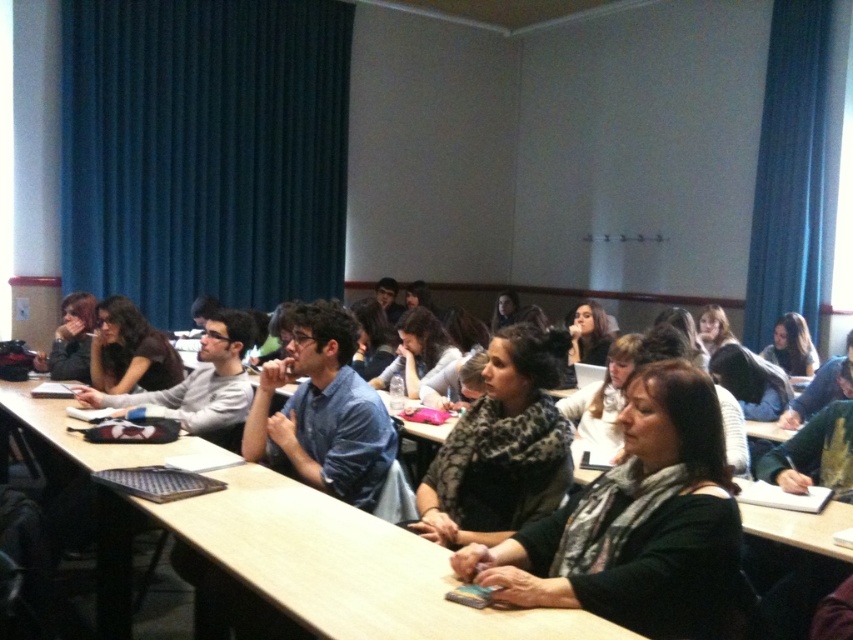
You are a student in the classroom. You need to place your black matte scarf at center on the wooden table at center. Will the scarf fit on the table?

The wooden table at center is much taller than the black matte scarf at center, so the scarf will fit on the table since height is not an issue for placement.

What is located at the coordinates point (x=318, y=564) in the classroom?

The wooden table at center is located at point (x=318, y=564).